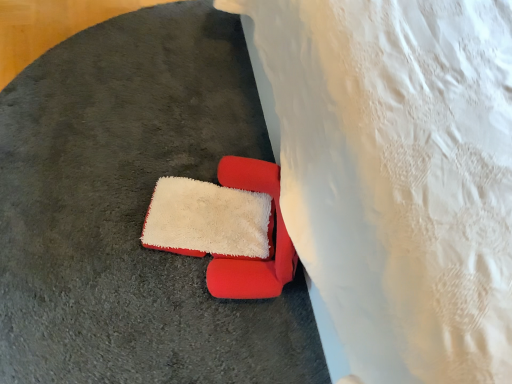
Question: Is white lace bedsheet at lower right wider or thinner than velvet red chair at center?

Choices:
 (A) wide
 (B) thin

Answer: (A)

Question: Is white lace bedsheet at lower right inside or outside of velvet red chair at center?

Choices:
 (A) inside
 (B) outside

Answer: (B)

Question: Is white lace bedsheet at lower right taller or shorter than velvet red chair at center?

Choices:
 (A) tall
 (B) short

Answer: (A)

Question: Considering the positions of point (246, 284) and point (480, 147), is point (246, 284) closer or farther from the camera than point (480, 147)?

Choices:
 (A) farther
 (B) closer

Answer: (A)

Question: In terms of size, does velvet red chair at center appear bigger or smaller than white lace bedsheet at lower right?

Choices:
 (A) small
 (B) big

Answer: (A)

Question: Which is correct: velvet red chair at center is inside white lace bedsheet at lower right, or outside of it?

Choices:
 (A) inside
 (B) outside

Answer: (B)

Question: From their relative heights in the image, would you say velvet red chair at center is taller or shorter than white lace bedsheet at lower right?

Choices:
 (A) tall
 (B) short

Answer: (B)